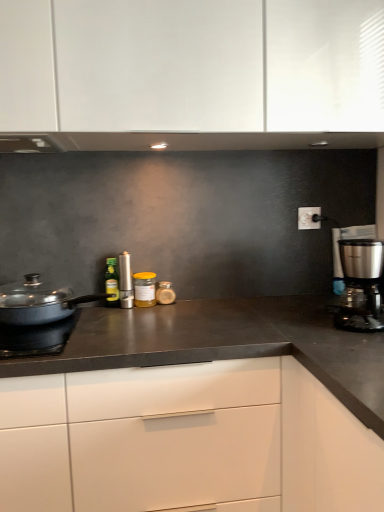
Locate an element on the screen. free space to the right of matte black pan at left is located at coordinates [x=162, y=319].